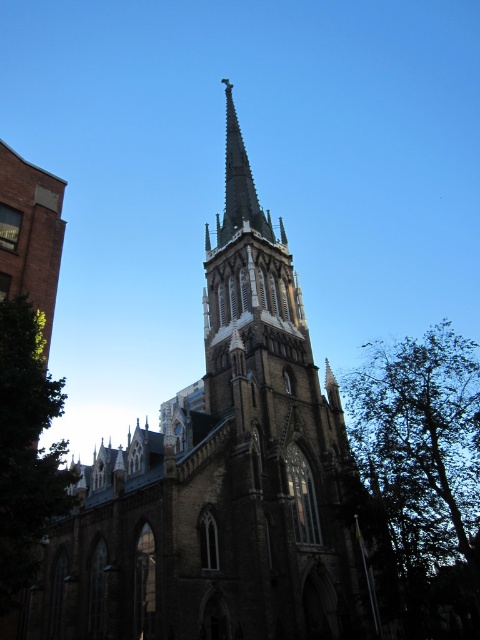
Is green leafy tree at right thinner than green leafy tree at lower left?

No, green leafy tree at right is not thinner than green leafy tree at lower left.

Based on the photo, between green leafy tree at right and green leafy tree at lower left, which one is positioned higher?

green leafy tree at right is higher up.

Between point (460, 576) and point (60, 483), which one is positioned behind?

Point (460, 576)

What are the coordinates of `green leafy tree at right` in the screenshot? It's located at (420, 477).

Can you confirm if stone church steeple at center is positioned above green leafy tree at right?

Yes.

Who is positioned more to the right, stone church steeple at center or green leafy tree at right?

Positioned to the right is green leafy tree at right.

Does point (261, 360) lie in front of point (475, 440)?

That is True.

At what (x,y) coordinates should I click in order to perform the action: click on stone church steeple at center. Please return your answer as a coordinate pair (x, y). The width and height of the screenshot is (480, 640). Looking at the image, I should click on (225, 477).

Is point (285, 285) closer to camera compared to point (15, 602)?

That is False.

Is the position of stone church steeple at center less distant than that of green leafy tree at lower left?

No, stone church steeple at center is further to the viewer.

I want to click on stone church steeple at center, so click(x=225, y=477).

You are a GUI agent. You are given a task and a screenshot of the screen. Output one action in this format:
    pyautogui.click(x=<x>, y=<y>)
    Task: Click on the stone church steeple at center
    The width and height of the screenshot is (480, 640).
    Given the screenshot: What is the action you would take?
    pos(225,477)